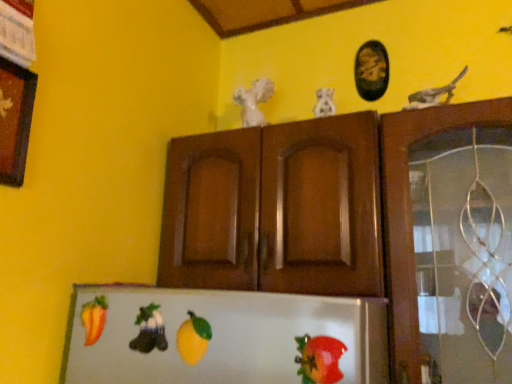
The width and height of the screenshot is (512, 384). I want to click on white matte sculpture at center, placed as the 3th animal when sorted from front to back, so click(x=253, y=101).

What do you see at coordinates (94, 319) in the screenshot? I see `smooth orange carrot at lower left, the second fruit viewed from the right` at bounding box center [94, 319].

Where is `smooth orange carrot at lower left, which is the 1th fruit in left-to-right order`? smooth orange carrot at lower left, which is the 1th fruit in left-to-right order is located at coordinates (94, 319).

This screenshot has height=384, width=512. Describe the element at coordinates (193, 338) in the screenshot. I see `yellow matte lemon at center, the 2th fruit positioned from the back` at that location.

Describe the element at coordinates (15, 120) in the screenshot. The height and width of the screenshot is (384, 512). I see `wooden picture frame at upper left, which is the 2th picture frame from top to bottom` at that location.

Measure the distance between point (153, 312) and camera.

Point (153, 312) is 30.75 inches from camera.

The image size is (512, 384). In order to click on green felt boot at lower center, the first animal viewed from the front in this screenshot , I will do `click(149, 330)`.

Image resolution: width=512 pixels, height=384 pixels. I want to click on white glossy statue at upper center, which ranks as the second animal in front-to-back order, so click(324, 103).

Which is more to the left, white matte sculpture at center, which is counted as the first animal, starting from the top, or wooden picture frame at upper left, positioned as the 1th picture frame in left-to-right order?

From the viewer's perspective, wooden picture frame at upper left, positioned as the 1th picture frame in left-to-right order, appears more on the left side.

From a real-world perspective, which object stands above the other?

white matte sculpture at center, the 2th animal viewed from the right.

You are a GUI agent. You are given a task and a screenshot of the screen. Output one action in this format:
    pyautogui.click(x=<x>, y=<y>)
    Task: Click on the picture frame in front of the white matte sculpture at center, which is the 1th animal in back-to-front order
    
    Given the screenshot: What is the action you would take?
    pyautogui.click(x=15, y=120)

Considering the positions of point (262, 102) and point (91, 330), is point (262, 102) closer or farther from the camera than point (91, 330)?

Point (262, 102) appears to be farther away from the viewer than point (91, 330).

Is white matte sculpture at center, placed as the 3th animal when sorted from front to back, looking in the opposite direction of smooth orange carrot at lower left, which is the 1th fruit in left-to-right order?

No, smooth orange carrot at lower left, which is the 1th fruit in left-to-right order, is not at the back of white matte sculpture at center, placed as the 3th animal when sorted from front to back.

Between white matte sculpture at center, acting as the second animal starting from the left, and smooth orange carrot at lower left, positioned as the second fruit in front-to-back order, which one has more height?

Standing taller between the two is white matte sculpture at center, acting as the second animal starting from the left.

Is white matte sculpture at center, which is counted as the first animal, starting from the top, placed right next to smooth orange carrot at lower left, which is the 1th fruit in back-to-front order?

white matte sculpture at center, which is counted as the first animal, starting from the top, and smooth orange carrot at lower left, which is the 1th fruit in back-to-front order, are clearly separated.

Is black oval frame at upper center, which ranks as the first picture frame in right-to-left order, taller or shorter than yellow matte lemon at center, which is the 1th fruit from right to left?

Considering their sizes, black oval frame at upper center, which ranks as the first picture frame in right-to-left order, has more height than yellow matte lemon at center, which is the 1th fruit from right to left.

From the image's perspective, is black oval frame at upper center, placed as the 1th picture frame when sorted from top to bottom, located beneath yellow matte lemon at center, marked as the 1th fruit in a front-to-back arrangement?

No, from the image's perspective, black oval frame at upper center, placed as the 1th picture frame when sorted from top to bottom, is not beneath yellow matte lemon at center, marked as the 1th fruit in a front-to-back arrangement.

Can you confirm if black oval frame at upper center, placed as the 1th picture frame when sorted from top to bottom, is positioned to the right of yellow matte lemon at center, the second fruit from the left?

Correct, you'll find black oval frame at upper center, placed as the 1th picture frame when sorted from top to bottom, to the right of yellow matte lemon at center, the second fruit from the left.

How many degrees apart are the facing directions of black oval frame at upper center, which is the 1th picture frame in back-to-front order, and yellow matte lemon at center, marked as the 1th fruit in a front-to-back arrangement?

0.00432 degrees separate the facing orientations of black oval frame at upper center, which is the 1th picture frame in back-to-front order, and yellow matte lemon at center, marked as the 1th fruit in a front-to-back arrangement.

From a real-world perspective, which object rests below the other?

brown glossy cabinet doors at center, from a real-world perspective.

Is the depth of brown glossy cabinet doors at center greater than that of black oval frame at upper center, which ranks as the first picture frame in right-to-left order?

No, brown glossy cabinet doors at center is closer to the viewer.

Does brown glossy cabinet doors at center have a greater width compared to black oval frame at upper center, which ranks as the 2th picture frame in left-to-right order?

Yes.

Does green felt boot at lower center, the first animal viewed from the front, turn towards shiny plastic tomato at lower right?

No, green felt boot at lower center, the first animal viewed from the front, is not aimed at shiny plastic tomato at lower right.

Locate an element on the screen. the 2nd animal to the left when counting from the shiny plastic tomato at lower right is located at coordinates (149, 330).

Between green felt boot at lower center, which is the first animal in left-to-right order, and shiny plastic tomato at lower right, which one has larger width?

green felt boot at lower center, which is the first animal in left-to-right order.

Considering the sizes of objects green felt boot at lower center, the first animal viewed from the front, and shiny plastic tomato at lower right in the image provided, who is shorter, green felt boot at lower center, the first animal viewed from the front, or shiny plastic tomato at lower right?

With less height is shiny plastic tomato at lower right.

Looking at this image, which is farther from the camera, [34,86] or [151,322]?

The point [34,86] is farther.

From the image's perspective, is wooden picture frame at upper left, positioned as the 1th picture frame in left-to-right order, below green felt boot at lower center, which is the third animal in right-to-left order?

No.

Is wooden picture frame at upper left, positioned as the 1th picture frame in left-to-right order, oriented towards green felt boot at lower center, the 3th animal viewed from the back?

No, wooden picture frame at upper left, positioned as the 1th picture frame in left-to-right order, is not oriented towards green felt boot at lower center, the 3th animal viewed from the back.

Consider the image. From a real-world perspective, does wooden picture frame at upper left, positioned as the 1th picture frame in left-to-right order, stand above green felt boot at lower center, the first animal when ordered from bottom to top?

Yes, from a real-world perspective, wooden picture frame at upper left, positioned as the 1th picture frame in left-to-right order, is on top of green felt boot at lower center, the first animal when ordered from bottom to top.

Based on the photo, is wooden picture frame at upper left, acting as the 2th picture frame starting from the right, looking in the opposite direction of white matte sculpture at center, which is counted as the first animal, starting from the top?

That's not correct — wooden picture frame at upper left, acting as the 2th picture frame starting from the right, is not looking away from white matte sculpture at center, which is counted as the first animal, starting from the top.

Would you say wooden picture frame at upper left, acting as the 2th picture frame starting from the right, is inside or outside white matte sculpture at center, which is the 1th animal in back-to-front order?

wooden picture frame at upper left, acting as the 2th picture frame starting from the right, is located beyond the bounds of white matte sculpture at center, which is the 1th animal in back-to-front order.

Is wooden picture frame at upper left, which is the 2th picture frame from top to bottom, at the left side of white matte sculpture at center, which is counted as the first animal, starting from the top?

Correct, you'll find wooden picture frame at upper left, which is the 2th picture frame from top to bottom, to the left of white matte sculpture at center, which is counted as the first animal, starting from the top.

Could you measure the distance between wooden picture frame at upper left, acting as the 1th picture frame starting from the bottom, and white matte sculpture at center, acting as the second animal starting from the left?

A distance of 63.16 centimeters exists between wooden picture frame at upper left, acting as the 1th picture frame starting from the bottom, and white matte sculpture at center, acting as the second animal starting from the left.

From the image's perspective, which animal is the 2nd one above the wooden picture frame at upper left, acting as the 1th picture frame starting from the bottom? Please provide its 2D coordinates.

[(253, 101)]

At what (x,y) coordinates should I click in order to perform the action: click on fruit that is the 1st object located below the white matte sculpture at center, the 2th animal viewed from the right (from the image's perspective). Please return your answer as a coordinate pair (x, y). This screenshot has width=512, height=384. Looking at the image, I should click on (94, 319).

Which object lies nearer to the anchor point white matte sculpture at center, the 2th animal viewed from the right, green felt boot at lower center, the first animal viewed from the front, or smooth orange carrot at lower left, which is the 1th fruit in back-to-front order?

smooth orange carrot at lower left, which is the 1th fruit in back-to-front order, is positioned closer to the anchor white matte sculpture at center, the 2th animal viewed from the right.

When comparing their distances from white glossy statue at upper center, which ranks as the second animal in front-to-back order, does shiny plastic tomato at lower right or white matte sculpture at center, the third animal from the bottom, seem closer?

white matte sculpture at center, the third animal from the bottom, is positioned closer to the anchor white glossy statue at upper center, which ranks as the second animal in front-to-back order.

Based on their spatial positions, is brown glossy cabinet doors at center or green felt boot at lower center, which is the first animal in left-to-right order, further from black oval frame at upper center, which ranks as the 2th picture frame in left-to-right order?

Among the two, green felt boot at lower center, which is the first animal in left-to-right order, is located further to black oval frame at upper center, which ranks as the 2th picture frame in left-to-right order.

From the image, which object appears to be nearer to shiny plastic tomato at lower right, smooth orange carrot at lower left, which is the 1th fruit in left-to-right order, or black oval frame at upper center, which ranks as the 2th picture frame in left-to-right order?

smooth orange carrot at lower left, which is the 1th fruit in left-to-right order.

From the image, which object appears to be farther from smooth orange carrot at lower left, positioned as the second fruit in front-to-back order, black oval frame at upper center, which ranks as the first picture frame in right-to-left order, or yellow matte lemon at center, which is the 1th fruit from right to left?

Based on the image, black oval frame at upper center, which ranks as the first picture frame in right-to-left order, appears to be further to smooth orange carrot at lower left, positioned as the second fruit in front-to-back order.

Based on their spatial positions, is white matte sculpture at center, which is counted as the first animal, starting from the top, or white glossy statue at upper center, the 3th animal from the left, closer to yellow matte lemon at center, the 2th fruit positioned from the back?

Among the two, white glossy statue at upper center, the 3th animal from the left, is located nearer to yellow matte lemon at center, the 2th fruit positioned from the back.

Based on their spatial positions, is black oval frame at upper center, which ranks as the 2th picture frame in left-to-right order, or shiny plastic tomato at lower right closer to white glossy statue at upper center, acting as the first animal starting from the right?

black oval frame at upper center, which ranks as the 2th picture frame in left-to-right order.

Looking at the image, which one is located closer to black oval frame at upper center, which ranks as the first picture frame in right-to-left order, smooth orange carrot at lower left, which is the 1th fruit in left-to-right order, or wooden picture frame at upper left, marked as the first picture frame in a front-to-back arrangement?

wooden picture frame at upper left, marked as the first picture frame in a front-to-back arrangement, is positioned closer to the anchor black oval frame at upper center, which ranks as the first picture frame in right-to-left order.

Locate an element on the screen. cabinetry positioned between wooden picture frame at upper left, which is the 2th picture frame from top to bottom, and white matte sculpture at center, the third animal from the bottom, from near to far is located at coordinates (275, 209).

At what (x,y) coordinates should I click in order to perform the action: click on fruit between white glossy statue at upper center, the 3th animal from the left, and yellow matte lemon at center, the second fruit from the left, from top to bottom. Please return your answer as a coordinate pair (x, y). Looking at the image, I should click on (94, 319).

Image resolution: width=512 pixels, height=384 pixels. In order to click on fruit situated between smooth orange carrot at lower left, which is the 1th fruit in left-to-right order, and brown glossy cabinet doors at center from left to right in this screenshot , I will do `click(193, 338)`.

Find the location of a particular element. Image resolution: width=512 pixels, height=384 pixels. vegetable situated between wooden picture frame at upper left, the second picture frame from the back, and black oval frame at upper center, placed as the 1th picture frame when sorted from top to bottom, from left to right is located at coordinates (319, 359).